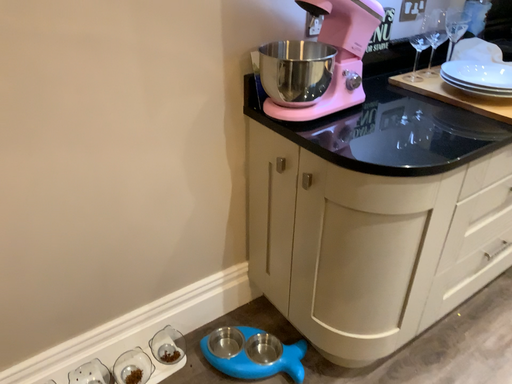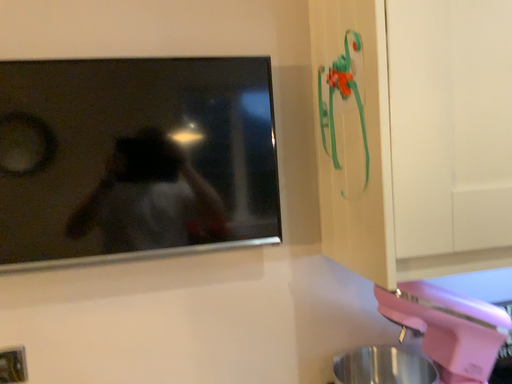
Question: How did the camera likely rotate when shooting the video?

Choices:
 (A) rotated left
 (B) rotated right

Answer: (A)